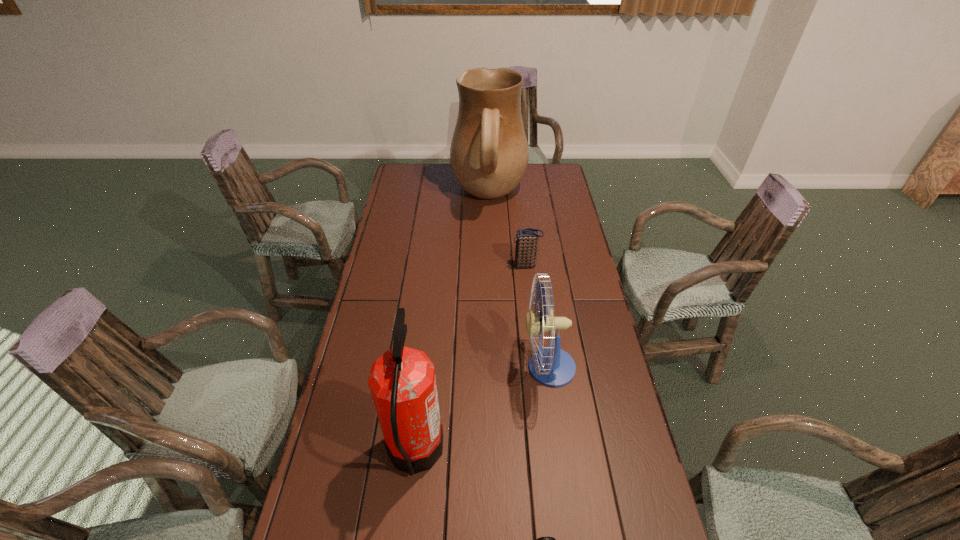
You are a GUI agent. You are given a task and a screenshot of the screen. Output one action in this format:
    pyautogui.click(x=<x>, y=<y>)
    Task: Click on the free region at the left edge of the desktop
    This screenshot has height=540, width=960.
    Given the screenshot: What is the action you would take?
    pyautogui.click(x=331, y=525)

This screenshot has width=960, height=540. I want to click on vacant space at the right edge, so click(x=636, y=472).

Locate an element on the screen. This screenshot has width=960, height=540. vacant space at the far right corner is located at coordinates (536, 169).

Locate an element on the screen. The image size is (960, 540). free space between the farthest object and the fourth farthest object is located at coordinates (452, 324).

The image size is (960, 540). In order to click on empty space that is in between the farthest object and the second nearest object in this screenshot , I will do `click(452, 324)`.

Find the location of a particular element. vacant area between the fire extinguisher and the third farthest object is located at coordinates (482, 410).

This screenshot has height=540, width=960. I want to click on the third closest object relative to the second farthest object, so click(x=402, y=382).

Locate an element on the screen. The width and height of the screenshot is (960, 540). the closest object relative to the tallest object is located at coordinates (527, 239).